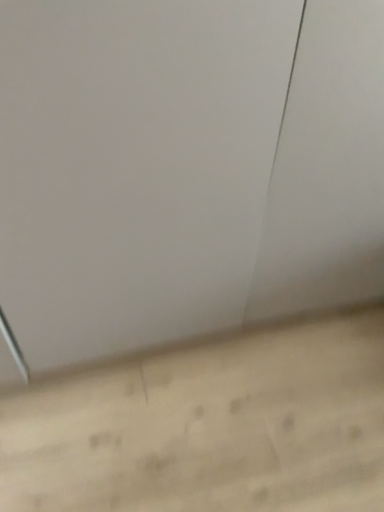
Identify the location of light wood plank at lower center. (209, 428).

What do you see at coordinates (209, 428) in the screenshot? I see `light wood plank at lower center` at bounding box center [209, 428].

Find the location of a particular element. This screenshot has height=512, width=384. light wood plank at lower center is located at coordinates (209, 428).